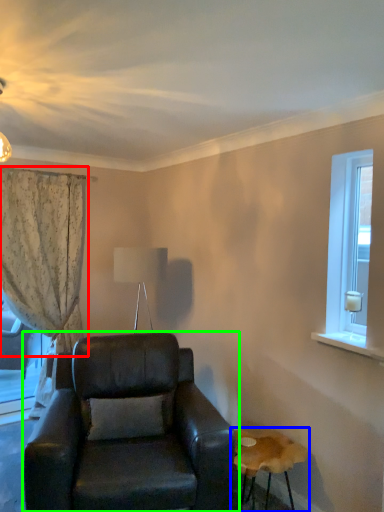
Question: Which is nearer to the curtain (highlighted by a red box)? table (highlighted by a blue box) or chair (highlighted by a green box).

Choices:
 (A) table
 (B) chair

Answer: (B)